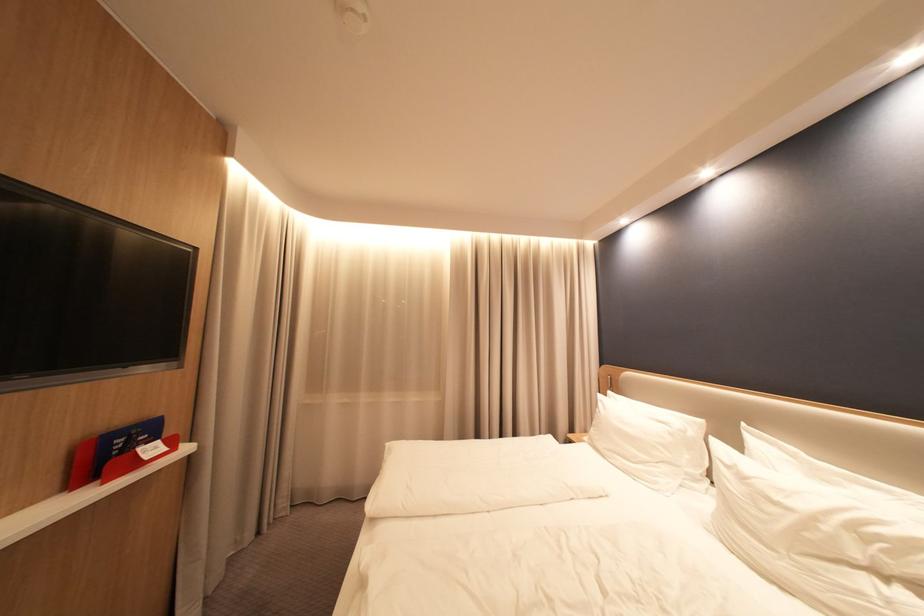
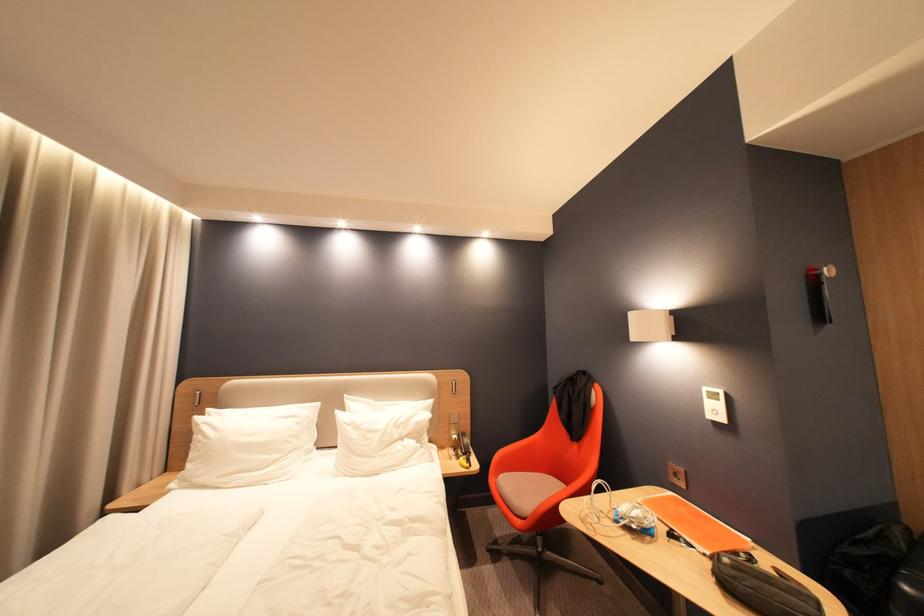
Locate, in the second image, the point that corresponds to [611,402] in the first image.

(213, 424)